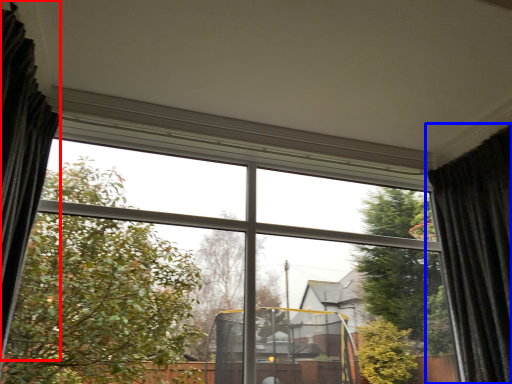
Question: Which point is further to the camera, curtain (highlighted by a red box) or curtain (highlighted by a blue box)?

Choices:
 (A) curtain
 (B) curtain

Answer: (B)